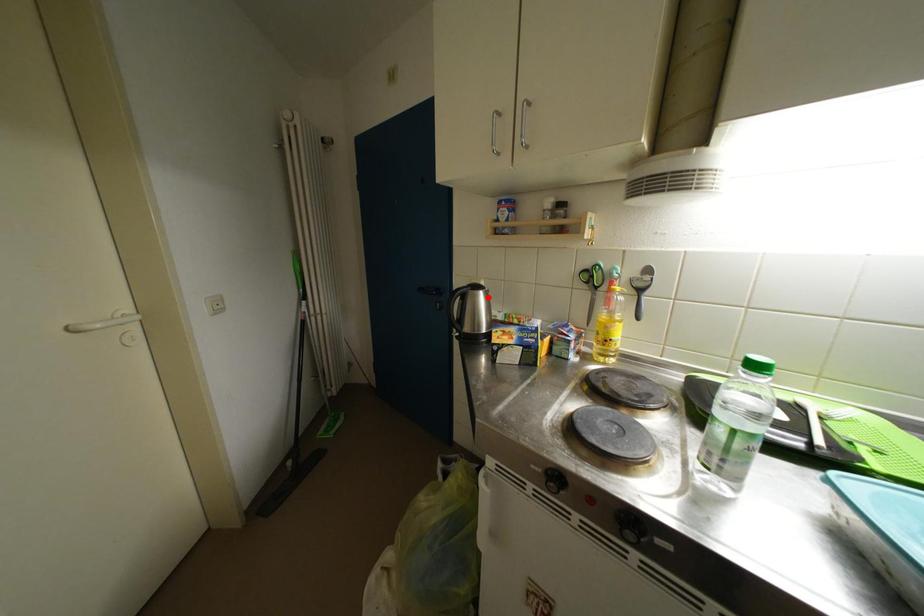
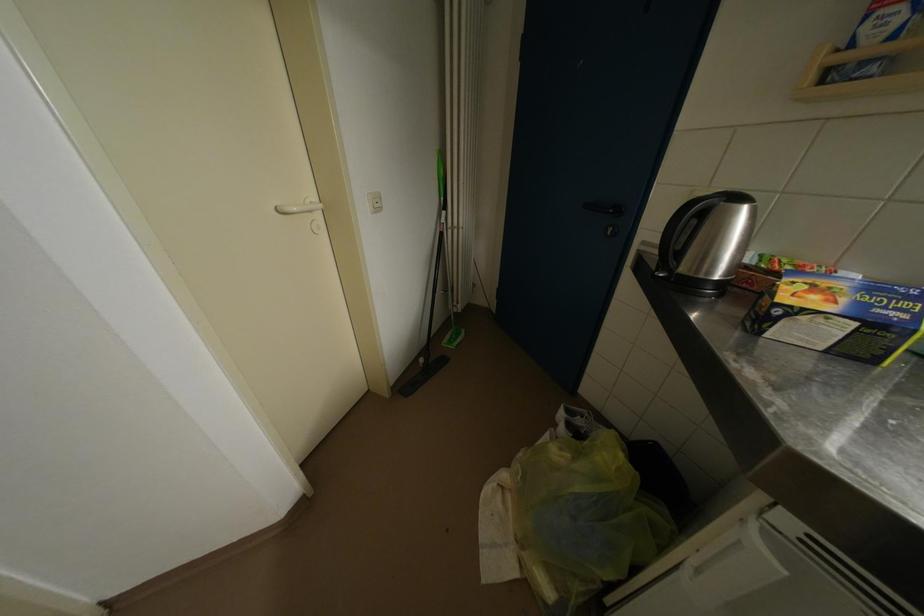
Find the pixel in the second image that matches the highlighted location in the first image.

(752, 213)